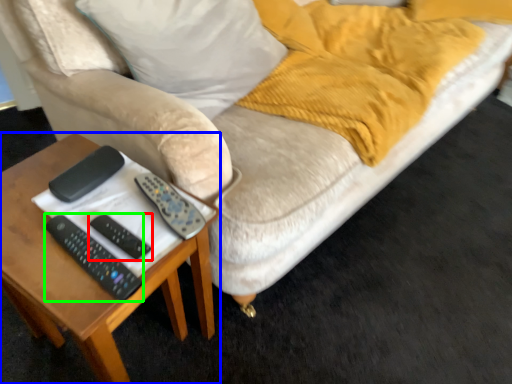
Question: Which is farther away from remote (highlighted by a red box)? table (highlighted by a blue box) or remote (highlighted by a green box)?

Choices:
 (A) table
 (B) remote

Answer: (A)